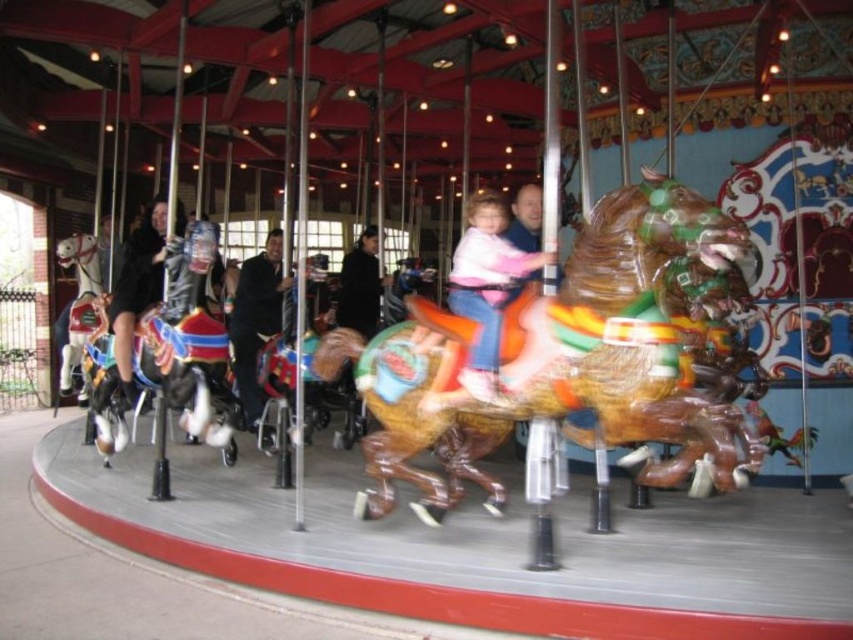
Which is more to the right, pink matte jacket at center or white glossy horse at left?

From the viewer's perspective, pink matte jacket at center appears more on the right side.

Is pink matte jacket at center further to camera compared to white glossy horse at left?

No, pink matte jacket at center is closer to the viewer.

At what (x,y) coordinates should I click in order to perform the action: click on pink matte jacket at center. Please return your answer as a coordinate pair (x, y). Image resolution: width=853 pixels, height=640 pixels. Looking at the image, I should click on (486, 288).

Is point (648, 252) positioned before point (467, 392)?

That is True.

Is shiny brown horse at center bigger than pink matte jacket at center?

Indeed, shiny brown horse at center has a larger size compared to pink matte jacket at center.

Locate an element on the screen. The width and height of the screenshot is (853, 640). shiny brown horse at center is located at coordinates (593, 355).

Which of these two, shiny brown horse at center or white glossy horse at left, stands shorter?

Standing shorter between the two is white glossy horse at left.

Which of these two, shiny brown horse at center or white glossy horse at left, stands taller?

Standing taller between the two is shiny brown horse at center.

Is point (599, 433) farther from camera compared to point (70, 301)?

That is False.

Where is `shiny brown horse at center`? This screenshot has height=640, width=853. shiny brown horse at center is located at coordinates (593, 355).